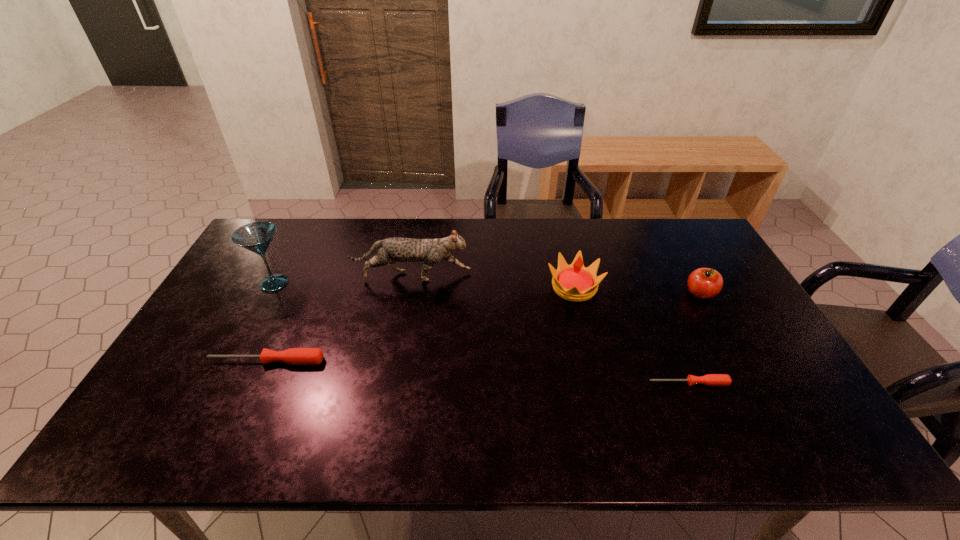
Find the location of a particular element. The image size is (960, 540). free space located 0.170m at the tip of the nearer screwdriver is located at coordinates (581, 383).

In order to click on vacant area situated at the tip of the nearer screwdriver in this screenshot , I will do `click(616, 383)`.

I want to click on vacant space situated 0.330m at the tip of the nearer screwdriver, so click(x=517, y=383).

Locate an element on the screen. This screenshot has height=540, width=960. vacant space located on the right of the fourth shortest object is located at coordinates (640, 287).

What are the coordinates of `vacant space located 0.170m on the back of the martini` in the screenshot? It's located at (297, 240).

Identify the location of vacant space located 0.330m on the face of the cat. The image size is (960, 540). (574, 276).

I want to click on vacant space located 0.290m on the front of the rightmost object, so click(x=751, y=384).

Image resolution: width=960 pixels, height=540 pixels. Identify the location of object that is positioned at the near edge. (710, 379).

Image resolution: width=960 pixels, height=540 pixels. Identify the location of screwdriver located in the left edge section of the desktop. (296, 356).

At what (x,y) coordinates should I click in order to perform the action: click on martini present at the left edge. Please return your answer as a coordinate pair (x, y). This screenshot has width=960, height=540. Looking at the image, I should click on (257, 236).